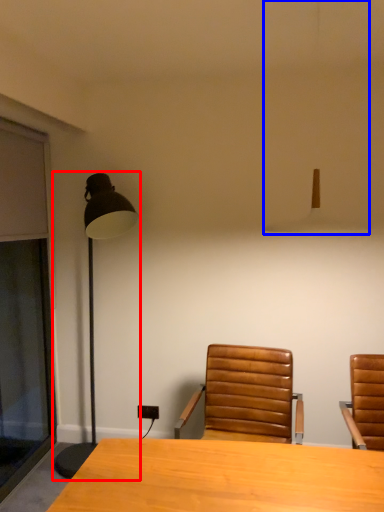
Question: Among these objects, which one is farthest to the camera, lamp (highlighted by a red box) or lamp (highlighted by a blue box)?

Choices:
 (A) lamp
 (B) lamp

Answer: (A)